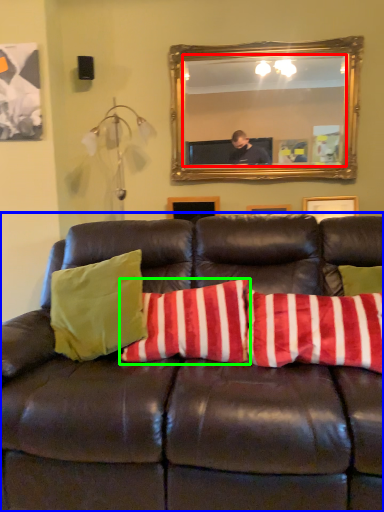
Question: Which object is positioned farthest from mirror (highlighted by a red box)? Select from studio couch (highlighted by a blue box) and pillow (highlighted by a green box).

Choices:
 (A) studio couch
 (B) pillow

Answer: (A)